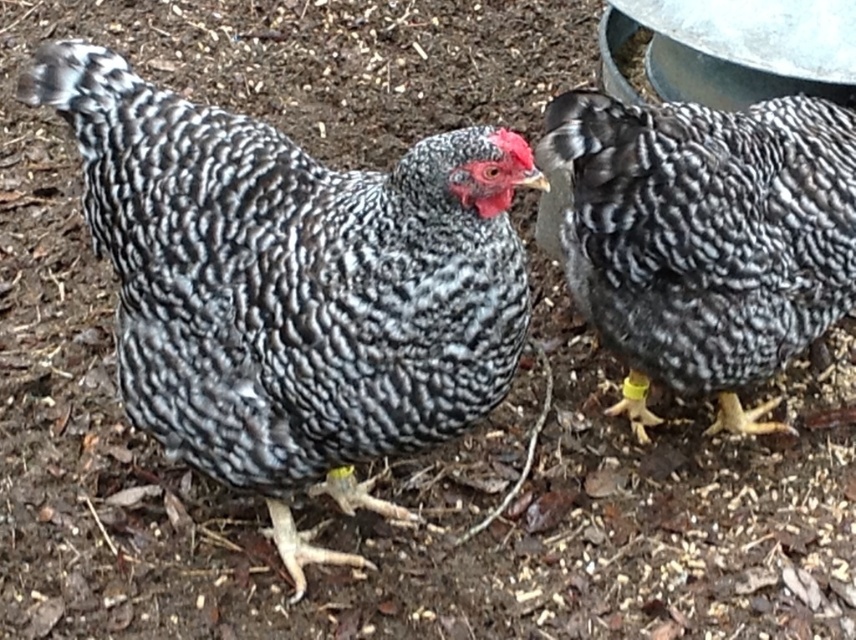
Is speckled feathered chicken at center below speckled feathered chicken at right?

Indeed, speckled feathered chicken at center is positioned under speckled feathered chicken at right.

Consider the image. Can you confirm if speckled feathered chicken at center is positioned to the left of speckled feathered chicken at right?

Yes, speckled feathered chicken at center is to the left of speckled feathered chicken at right.

Which is in front, point (432, 275) or point (807, 196)?

Positioned in front is point (432, 275).

At what (x,y) coordinates should I click in order to perform the action: click on speckled feathered chicken at center. Please return your answer as a coordinate pair (x, y). Looking at the image, I should click on (292, 285).